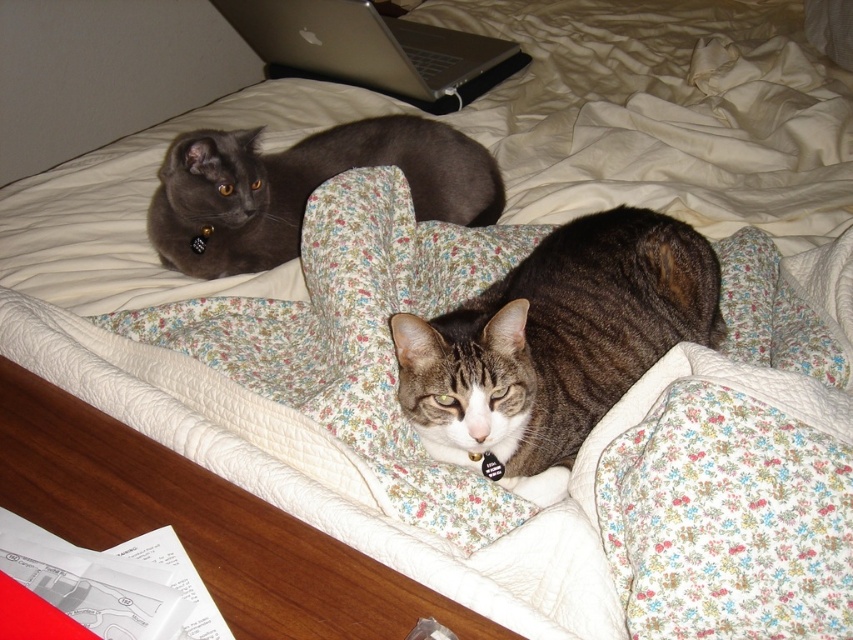
You are trying to place a new decorative item on the bed. The bed has a white quilted cover with a floral pillow. You have a small statue that needs to be placed either on the tabby fur cat at center or the silver metallic laptop at upper center. Based on their positions, where would you place it to ensure it doesn

The tabby fur cat at center is below the silver metallic laptop at upper center, so placing the statue on the silver metallic laptop at upper center would be higher up and more visible.

You are a cat owner who wants to place a small toy between the tabby fur cat at center and the matte gray cat at upper left. The toy requires at least 15 inches of space to avoid disturbing them. Based on the scene, will the available space between the two cats be sufficient?

The tabby fur cat at center is 14.99 inches away from matte gray cat at upper left, so the space between them is just shy of 15 inches. The toy might not fit without disturbing them, as the distance is slightly less than required.